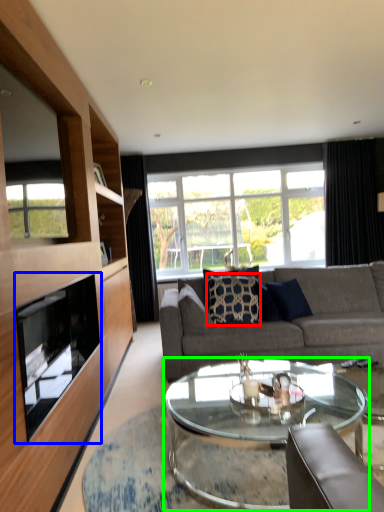
Question: Which object is the closest to the pillow (highlighted by a red box)? Choose among these: fireplace (highlighted by a blue box) or coffee table (highlighted by a green box).

Choices:
 (A) fireplace
 (B) coffee table

Answer: (B)